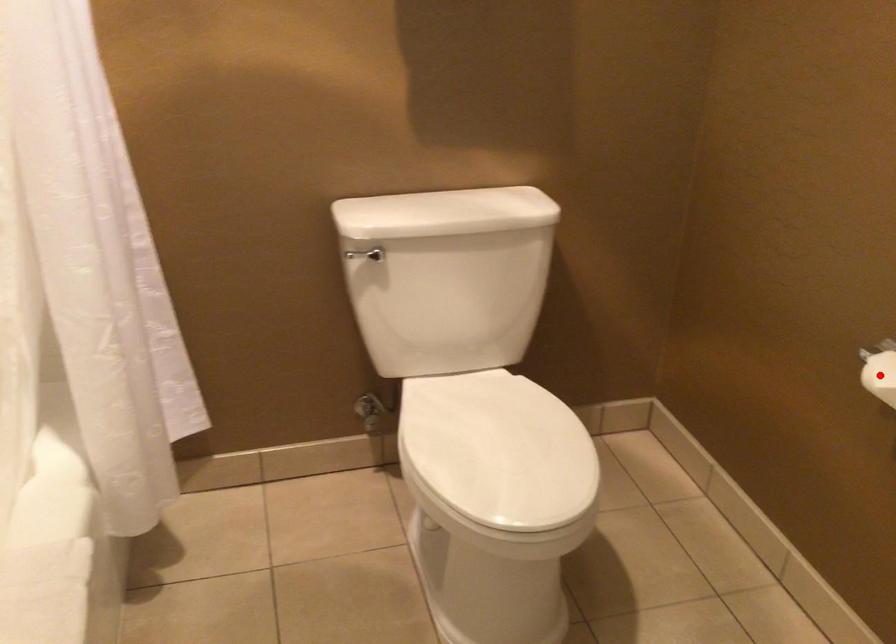
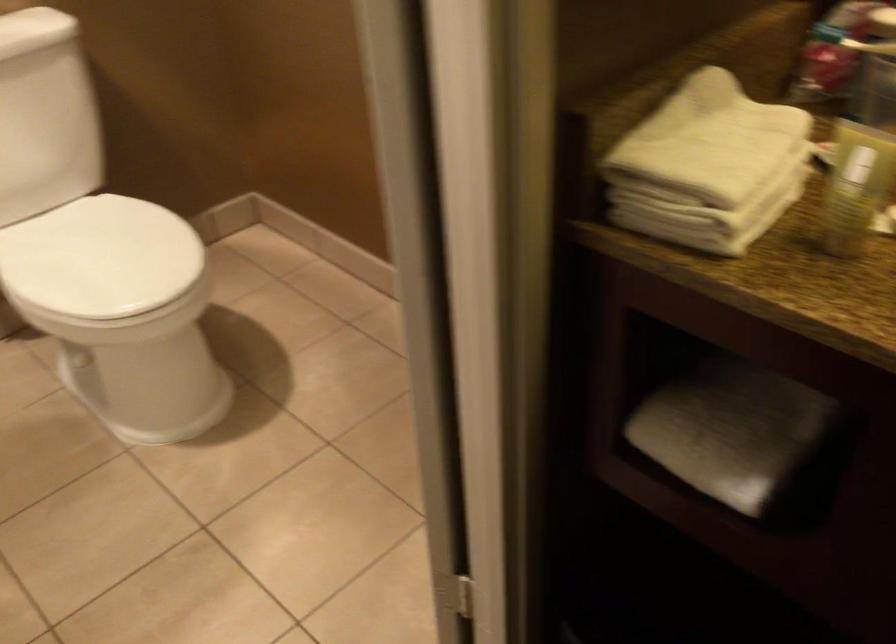
Question: I am providing you with two images of the same scene from different viewpoints. A red point is marked on the first image. Is the red point's position out of view in image 2?

Choices:
 (A) Yes
 (B) No

Answer: (A)